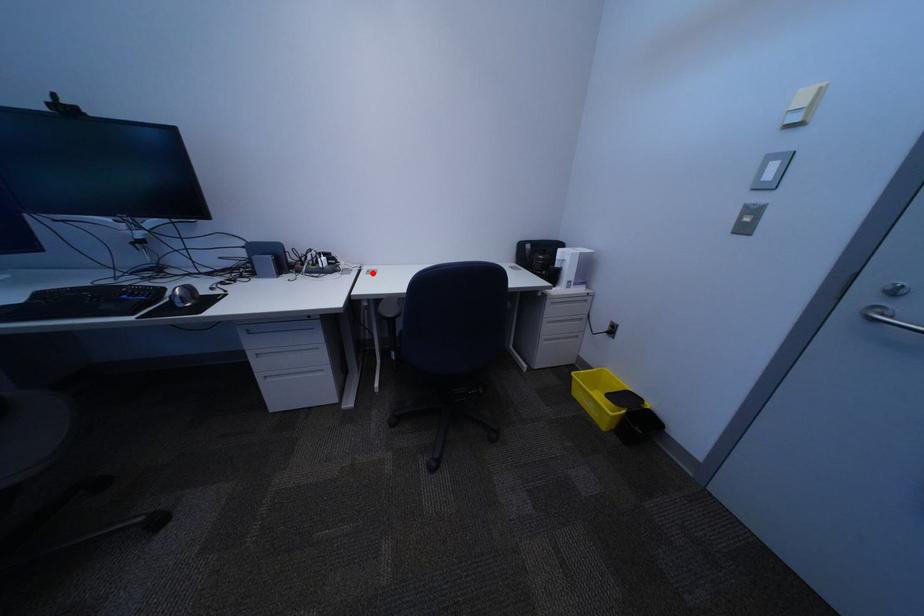
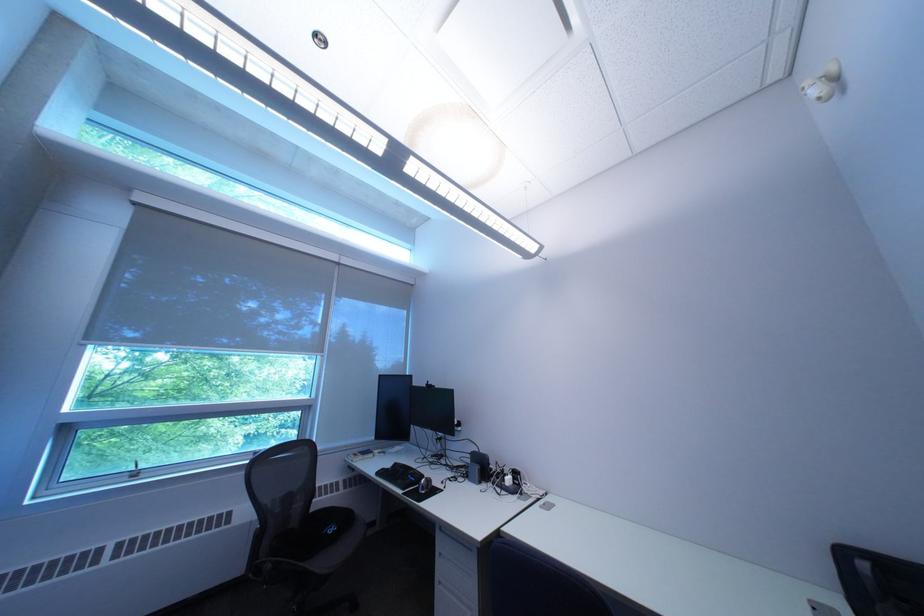
Locate, in the second image, the point that corresponds to the highlighted location in the first image.

(551, 501)